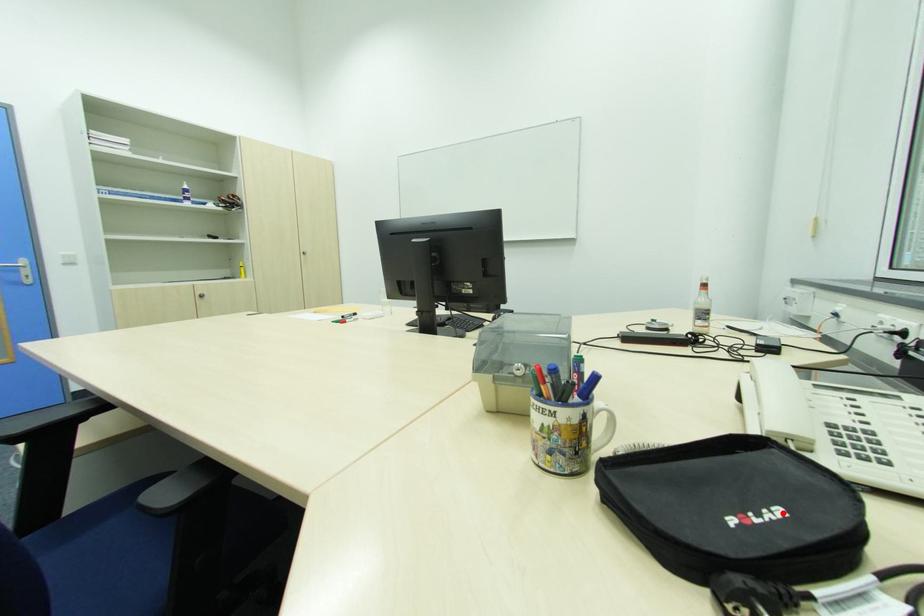
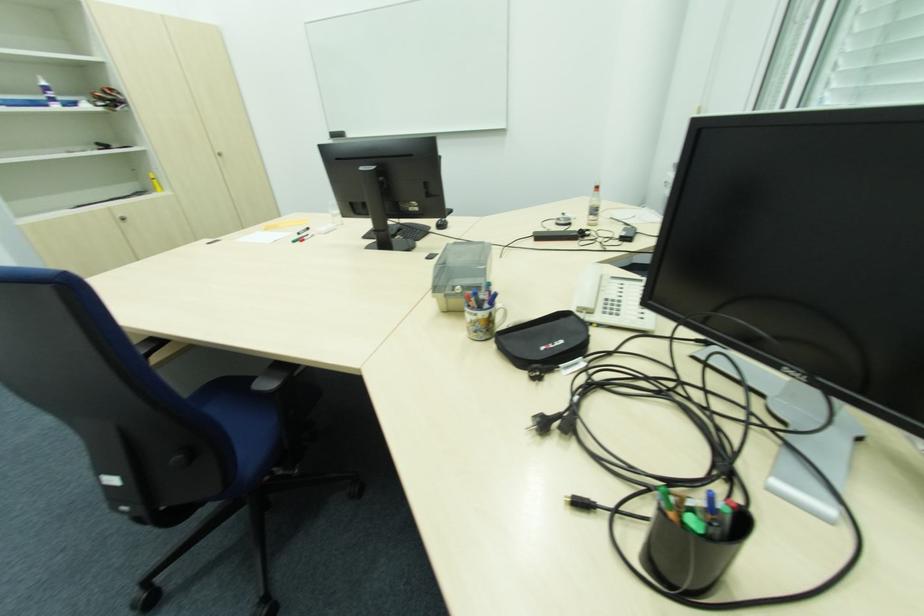
Where in the second image is the point corresponding to the highlighted location from the first image?

(565, 342)